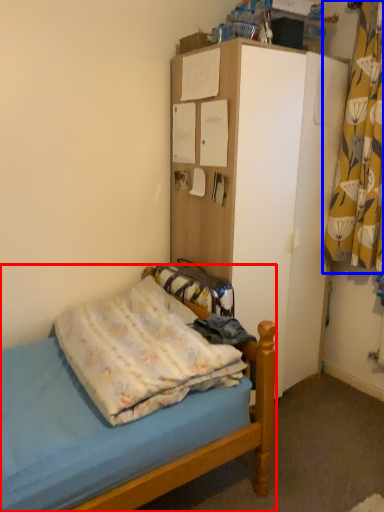
Question: Which point is further to the camera, bed (highlighted by a red box) or curtain (highlighted by a blue box)?

Choices:
 (A) bed
 (B) curtain

Answer: (B)